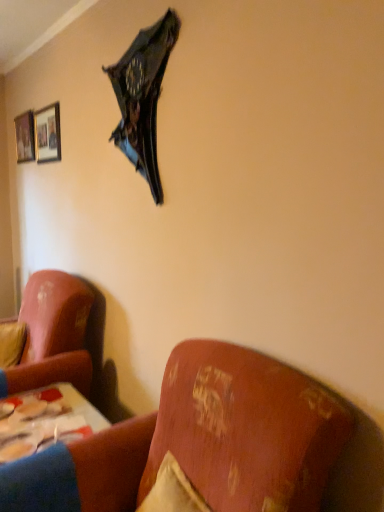
Question: Is wooden framed picture at upper left, arranged as the 1th picture frame when viewed from the back, beside shiny metallic umbrella at upper center?

Choices:
 (A) yes
 (B) no

Answer: (B)

Question: Is shiny metallic umbrella at upper center at the back of wooden framed picture at upper left, the second picture frame when ordered from right to left?

Choices:
 (A) no
 (B) yes

Answer: (A)

Question: From the image's perspective, does wooden framed picture at upper left, the second picture frame when ordered from right to left, appear higher than shiny metallic umbrella at upper center?

Choices:
 (A) yes
 (B) no

Answer: (A)

Question: Considering the relative sizes of wooden framed picture at upper left, arranged as the 1th picture frame when viewed from the left, and shiny metallic umbrella at upper center in the image provided, is wooden framed picture at upper left, arranged as the 1th picture frame when viewed from the left, smaller than shiny metallic umbrella at upper center?

Choices:
 (A) yes
 (B) no

Answer: (A)

Question: Is wooden framed picture at upper left, arranged as the 1th picture frame when viewed from the left, in front of shiny metallic umbrella at upper center?

Choices:
 (A) no
 (B) yes

Answer: (A)

Question: From a real-world perspective, is matte black picture frame at upper left, which is the 1th picture frame from front to back, above or below shiny metallic umbrella at upper center?

Choices:
 (A) above
 (B) below

Answer: (A)

Question: Is point (46, 131) positioned closer to the camera than point (144, 104)?

Choices:
 (A) closer
 (B) farther

Answer: (B)

Question: Is matte black picture frame at upper left, the first picture frame from the right, in front of or behind shiny metallic umbrella at upper center in the image?

Choices:
 (A) front
 (B) behind

Answer: (B)

Question: Considering the positions of matte black picture frame at upper left, which is the 1th picture frame from front to back, and shiny metallic umbrella at upper center in the image, is matte black picture frame at upper left, which is the 1th picture frame from front to back, taller or shorter than shiny metallic umbrella at upper center?

Choices:
 (A) short
 (B) tall

Answer: (A)

Question: Is velvet yellow pillow at left in front of or behind wooden table at lower left in the image?

Choices:
 (A) behind
 (B) front

Answer: (A)

Question: In terms of height, does velvet yellow pillow at left look taller or shorter compared to wooden table at lower left?

Choices:
 (A) tall
 (B) short

Answer: (B)

Question: From a real-world perspective, is velvet yellow pillow at left positioned above or below wooden table at lower left?

Choices:
 (A) below
 (B) above

Answer: (B)

Question: From the image's perspective, is velvet yellow pillow at left located above or below wooden table at lower left?

Choices:
 (A) below
 (B) above

Answer: (B)

Question: Is velvet-like pink couch at lower left taller or shorter than velvet yellow pillow at left?

Choices:
 (A) short
 (B) tall

Answer: (B)

Question: From the image's perspective, relative to velvet yellow pillow at left, is velvet-like pink couch at lower left above or below?

Choices:
 (A) below
 (B) above

Answer: (A)